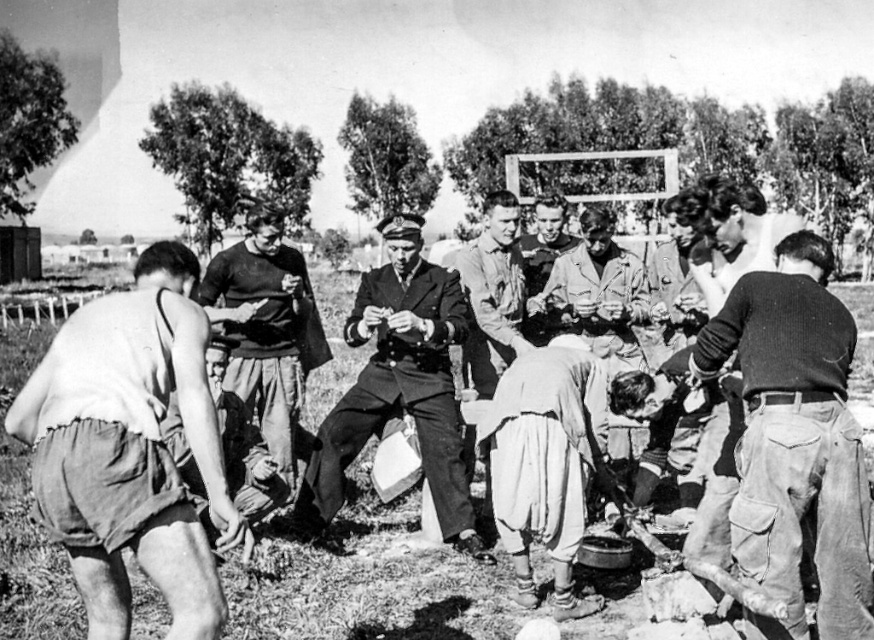
You are organizing a group photo and need to ensure everyone fits within the frame. The camera you are using has a maximum width capacity of 1.5 meters. Given that the uniformed man at center and the smooth leather jacket at center are both in the frame, will they both fit comfortably within the camera frame?

The uniformed man at center is narrower than the smooth leather jacket at center. Since the camera can accommodate up to 1.5 meters, and the jacket is wider than the man, as long as the jacket fits within the frame, the man should also fit comfortably. However, the total combined width of both might exceed the limit if they are positioned side by side. The description only specifies their individual widths relative to each other, not the total required space.

You are organizing a winter outdoor event and need to determine which clothing item would provide better insulation between the dark wool sweater at center right and the smooth leather jacket at center. Based on their thickness, which one would be more suitable for cold weather?

The smooth leather jacket at center is thicker than the dark wool sweater at center right, so it would provide better insulation and be more suitable for cold weather.